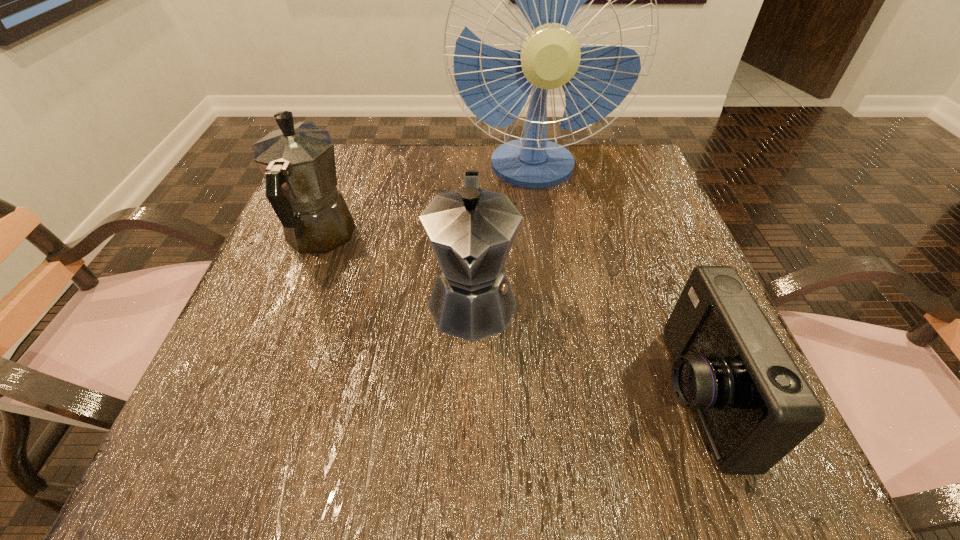
Where is `vacant region at the far edge of the desktop`? This screenshot has width=960, height=540. vacant region at the far edge of the desktop is located at coordinates (393, 164).

This screenshot has height=540, width=960. Find the location of `vacant space at the near edge of the desktop`. vacant space at the near edge of the desktop is located at coordinates (518, 429).

Where is `vacant space at the left edge`? vacant space at the left edge is located at coordinates (272, 310).

Identify the location of free region at the right edge of the desktop. This screenshot has width=960, height=540. (613, 286).

Image resolution: width=960 pixels, height=540 pixels. In the image, there is a desktop. Find the location of `vacant space at the far left corner`. vacant space at the far left corner is located at coordinates (371, 176).

In the image, there is a desktop. At what (x,y) coordinates should I click in order to perform the action: click on free space at the far right corner. Please return your answer as a coordinate pair (x, y). The height and width of the screenshot is (540, 960). Looking at the image, I should click on (641, 198).

Image resolution: width=960 pixels, height=540 pixels. Find the location of `unoccupied area between the right coffeepot and the leftmost object`. unoccupied area between the right coffeepot and the leftmost object is located at coordinates (396, 269).

Identify the location of vacant region between the leftmost object and the fan. Image resolution: width=960 pixels, height=540 pixels. (426, 203).

At what (x,y) coordinates should I click in order to perform the action: click on free space that is in between the camera and the tallest object. Please return your answer as a coordinate pair (x, y). Image resolution: width=960 pixels, height=540 pixels. Looking at the image, I should click on (613, 281).

Where is `free space between the farthest object and the leftmost object`? free space between the farthest object and the leftmost object is located at coordinates (426, 203).